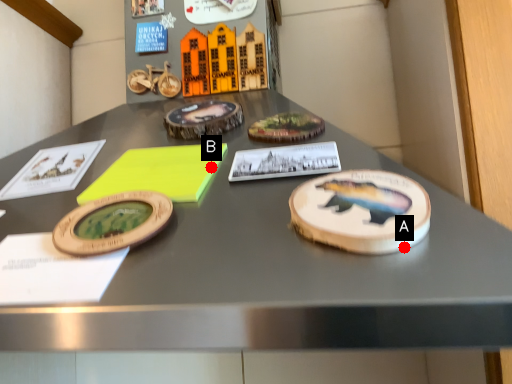
Question: Two points are circled on the image, labeled by A and B beside each circle. Which point is closer to the camera?

Choices:
 (A) A is closer
 (B) B is closer

Answer: (A)